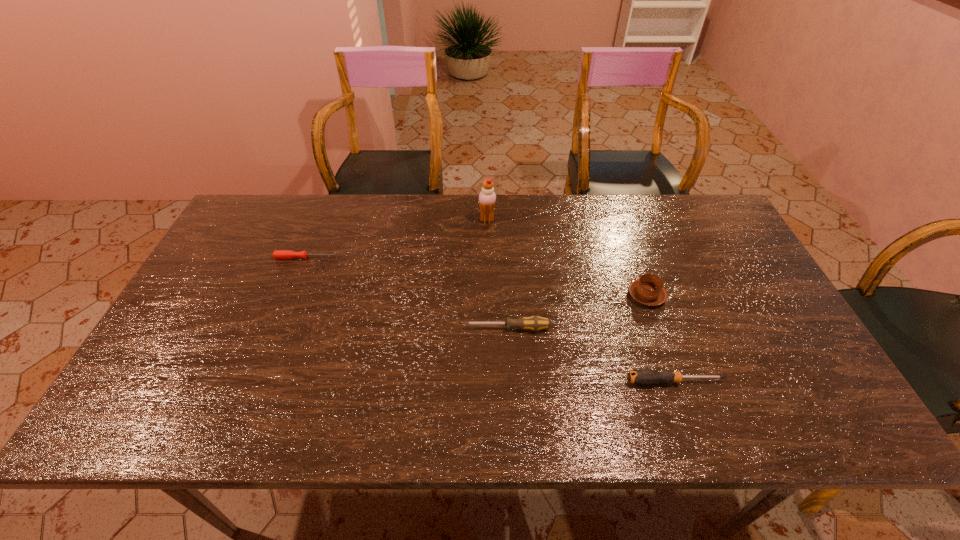
This screenshot has width=960, height=540. Identify the location of icecream. (487, 197).

The height and width of the screenshot is (540, 960). In order to click on the tallest object in this screenshot , I will do `click(487, 197)`.

Find the location of a particular element. The height and width of the screenshot is (540, 960). the third farthest object is located at coordinates (649, 290).

Where is `cappuccino`? cappuccino is located at coordinates (649, 290).

The height and width of the screenshot is (540, 960). I want to click on the second screwdriver from left to right, so click(535, 323).

This screenshot has height=540, width=960. Find the location of `the fourth farthest object`. the fourth farthest object is located at coordinates (535, 323).

In order to click on the nearest object in this screenshot , I will do `click(642, 376)`.

Where is `the rightmost screwdriver`? Image resolution: width=960 pixels, height=540 pixels. the rightmost screwdriver is located at coordinates (642, 376).

Locate an element on the screen. Image resolution: width=960 pixels, height=540 pixels. the leftmost screwdriver is located at coordinates (278, 254).

Find the location of a particular element. the shortest object is located at coordinates (278, 254).